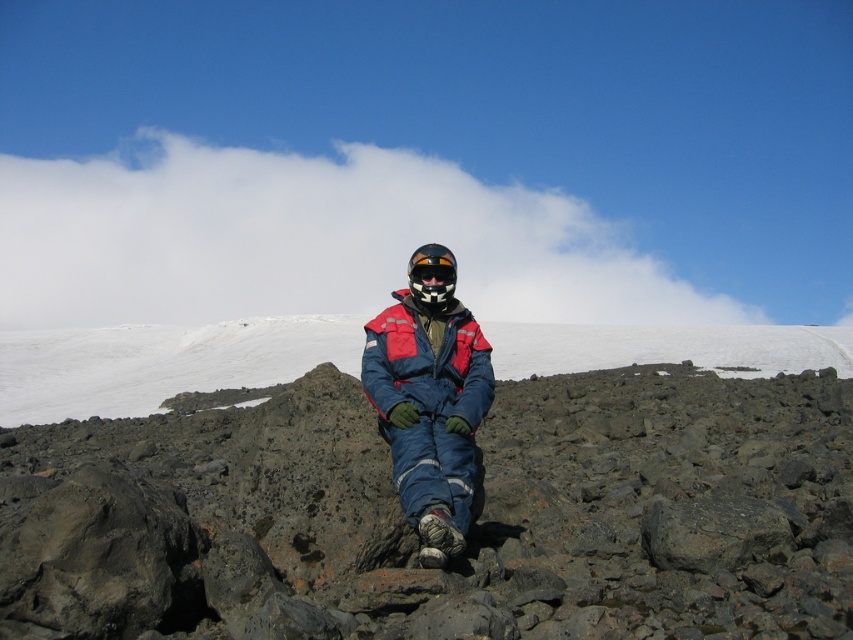
Which of these two, smooth volcanic rock at center or black matte goggles at center, stands taller?

Standing taller between the two is smooth volcanic rock at center.

Who is positioned more to the left, smooth volcanic rock at center or black matte goggles at center?

smooth volcanic rock at center is more to the left.

From the picture: Who is more distant from viewer, (271, 534) or (447, 276)?

Point (447, 276)

Locate an element on the screen. This screenshot has height=640, width=853. smooth volcanic rock at center is located at coordinates (471, 525).

Does white fluffy cloud at upper center have a smaller size compared to black matte helmet at center?

No, white fluffy cloud at upper center is not smaller than black matte helmet at center.

Is point (13, 316) more distant than point (436, 276)?

Yes.

Identify the location of white fluffy cloud at upper center. This screenshot has height=640, width=853. (308, 241).

Describe the element at coordinates (471, 525) in the screenshot. I see `smooth volcanic rock at center` at that location.

Image resolution: width=853 pixels, height=640 pixels. In order to click on smooth volcanic rock at center in this screenshot , I will do `click(471, 525)`.